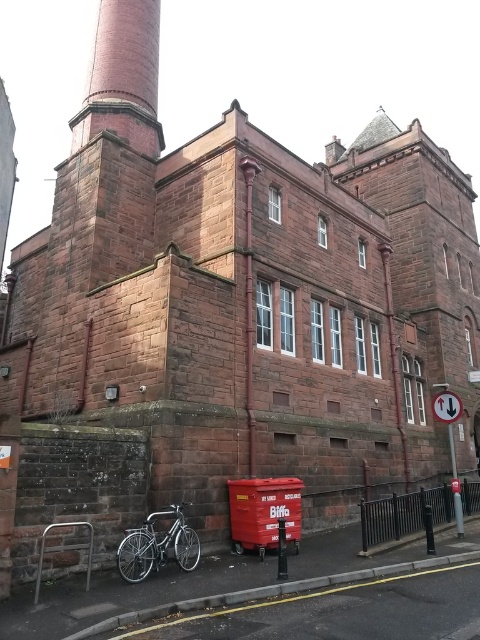
Based on the photo, between red brick chimney at upper left and silver metallic bicycle at lower left, which one appears on the right side from the viewer's perspective?

silver metallic bicycle at lower left is more to the right.

What do you see at coordinates (122, 77) in the screenshot? I see `red brick chimney at upper left` at bounding box center [122, 77].

Who is more distant from viewer, (120, 109) or (176, 516)?

Positioned behind is point (120, 109).

Locate an element on the screen. Image resolution: width=480 pixels, height=640 pixels. red brick chimney at upper left is located at coordinates (122, 77).